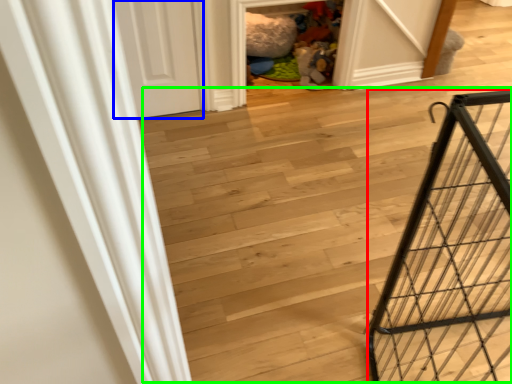
Question: Which object is positioned closest to cage (highlighted by a red box)? Select from door (highlighted by a blue box) and stairwell (highlighted by a green box).

Choices:
 (A) door
 (B) stairwell

Answer: (B)